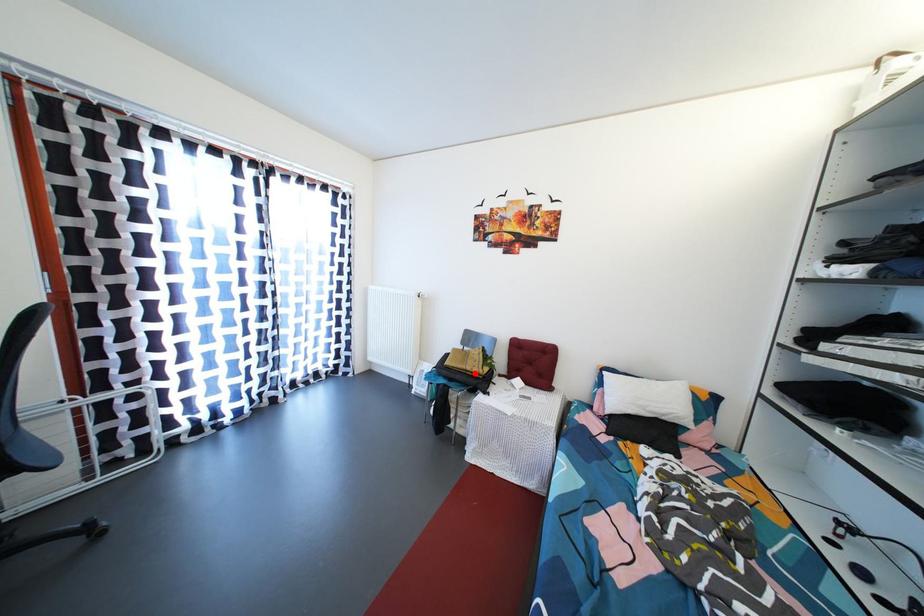
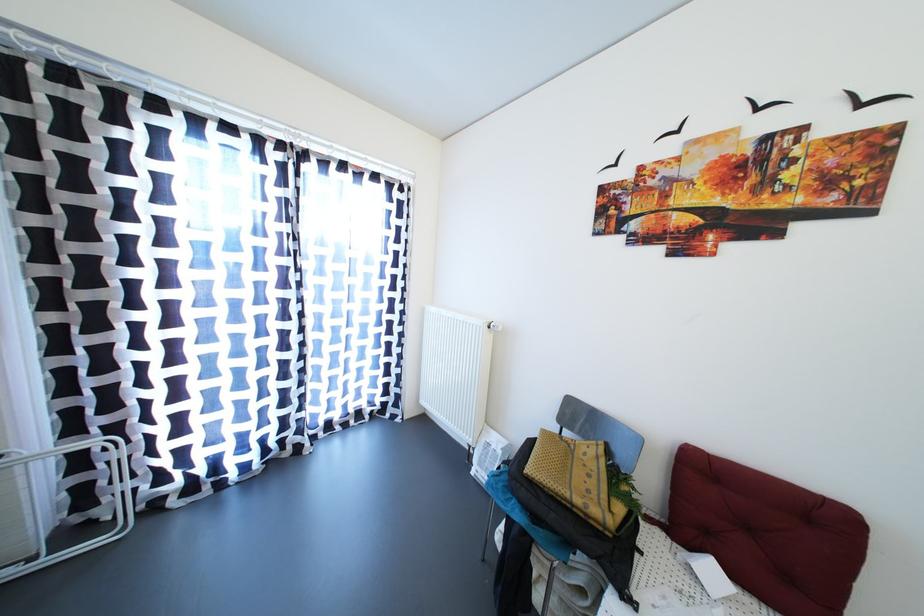
Find the pixel in the second image that matches the highlighted location in the first image.

(584, 506)